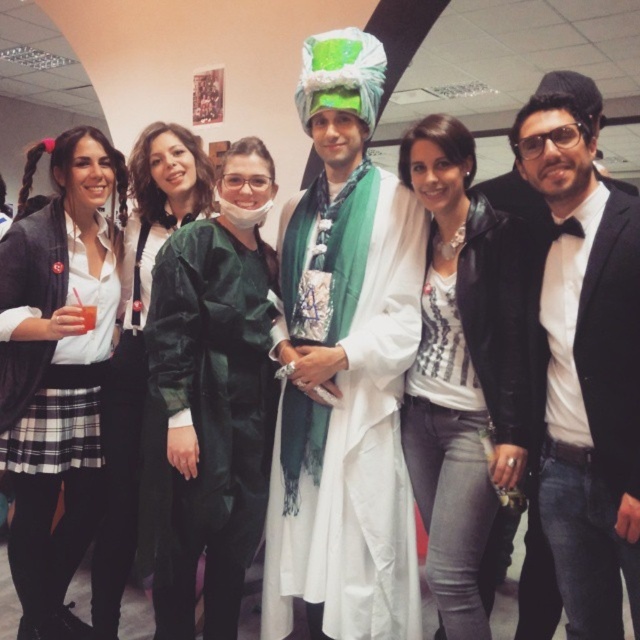
Based on the scene description, where is the black satin bow tie at right located in terms of coordinates?

The black satin bow tie at right is located at coordinates point (586, 369).